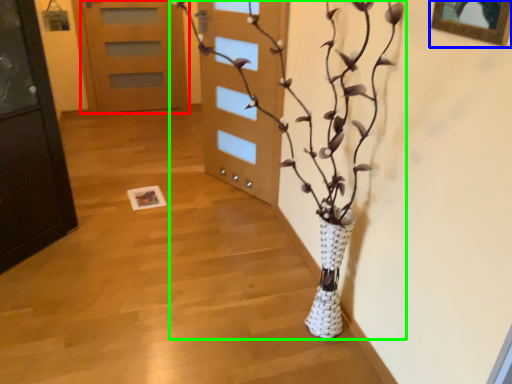
Question: Estimate the real-world distances between objects in this image. Which object is closer to door (highlighted by a red box), picture frame (highlighted by a blue box) or houseplant (highlighted by a green box)?

Choices:
 (A) picture frame
 (B) houseplant

Answer: (B)